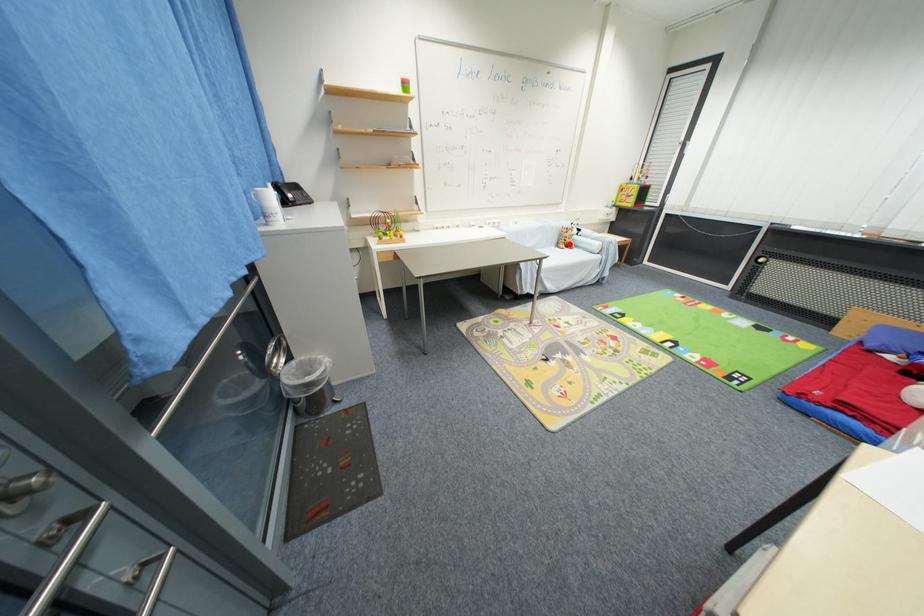
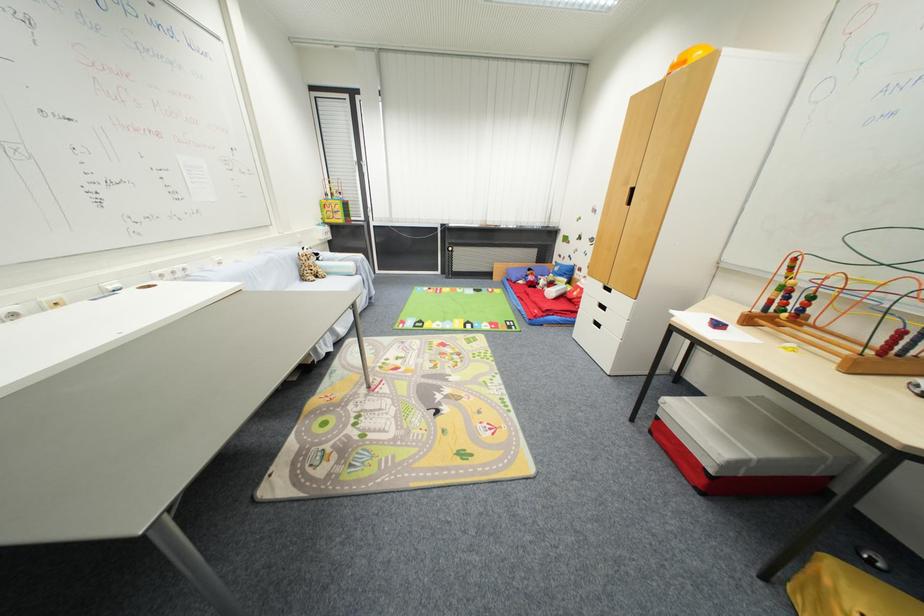
Question: A red point is marked in image1. In image2, is the corresponding 3D point closer to the camera or farther? Reply with the corresponding letter.

Choices:
 (A) The corresponding 3D point is closer.
 (B) The corresponding 3D point is farther.

Answer: (A)